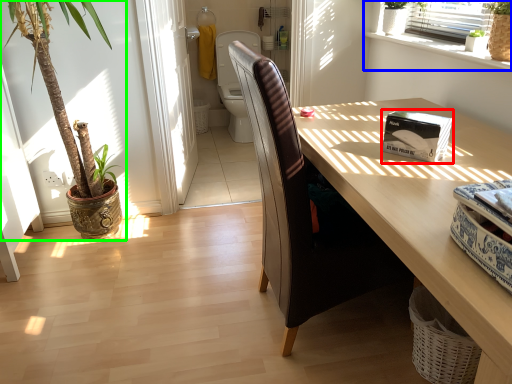
Question: Which is nearer to the box (highlighted by a red box)? window (highlighted by a blue box) or houseplant (highlighted by a green box).

Choices:
 (A) window
 (B) houseplant

Answer: (A)